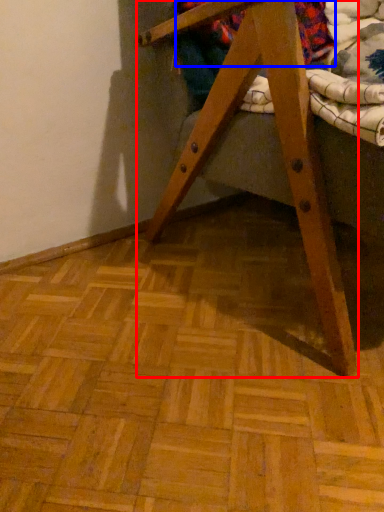
Question: Among these objects, which one is farthest to the camera, furniture (highlighted by a red box) or underclothes (highlighted by a blue box)?

Choices:
 (A) furniture
 (B) underclothes

Answer: (B)